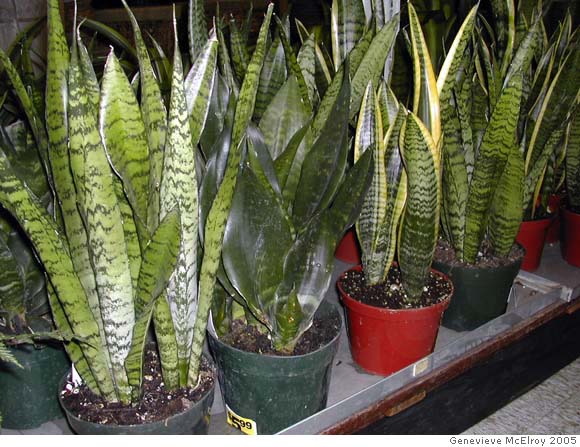
At what (x,y) coordinates should I click in order to perform the action: click on raised platform. Please return your answer as a coordinate pair (x, y). The image size is (580, 447). Looking at the image, I should click on (358, 397).